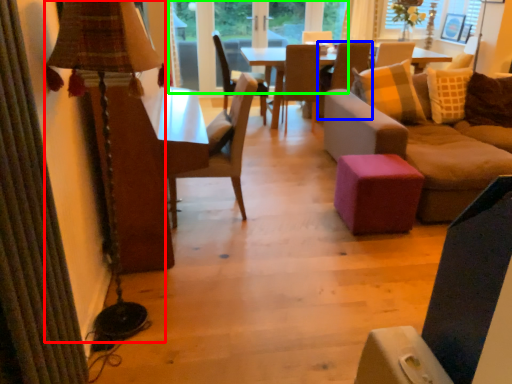
Question: Based on their relative distances, which object is farther from table lamp (highlighted by a red box)? Choose from chair (highlighted by a blue box) and window frame (highlighted by a green box).

Choices:
 (A) chair
 (B) window frame

Answer: (B)